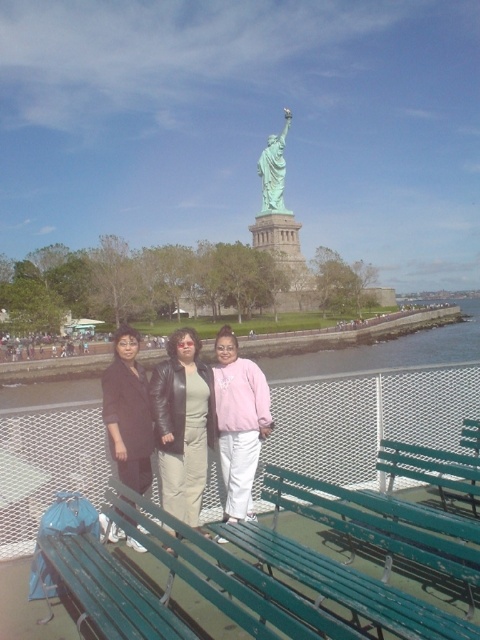
Does point (237, 508) come in front of point (261, 161)?

That is True.

Is point (255, 456) less distant than point (285, 116)?

Yes, it is in front of point (285, 116).

I want to click on pink fleece jacket at center, so click(x=239, y=422).

Can you confirm if green metallic water at lower center is positioned to the right of dark brown leather jacket at center?

Indeed, green metallic water at lower center is positioned on the right side of dark brown leather jacket at center.

Does green metallic water at lower center have a lesser width compared to dark brown leather jacket at center?

Incorrect, green metallic water at lower center's width is not less than dark brown leather jacket at center's.

Find the location of `green metallic water at lower center`. green metallic water at lower center is located at coordinates click(x=372, y=401).

Who is lower down, leather jacket at center or pink fleece jacket at center?

leather jacket at center is lower down.

Who is positioned more to the left, leather jacket at center or pink fleece jacket at center?

From the viewer's perspective, leather jacket at center appears more on the left side.

Who is more forward, (194, 378) or (224, 513)?

Positioned in front is point (224, 513).

Locate an element on the screen. The height and width of the screenshot is (640, 480). leather jacket at center is located at coordinates (182, 426).